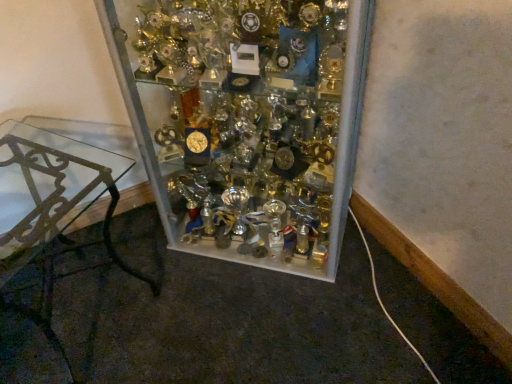
Question: Looking at their shapes, would you say clear glass trophy case at center is wider or thinner than clear glass table at left?

Choices:
 (A) thin
 (B) wide

Answer: (B)

Question: From the image's perspective, is clear glass trophy case at center above or below clear glass table at left?

Choices:
 (A) below
 (B) above

Answer: (B)

Question: Is clear glass trophy case at center inside or outside of clear glass table at left?

Choices:
 (A) inside
 (B) outside

Answer: (B)

Question: In the image, is clear glass table at left on the left side or the right side of clear glass trophy case at center?

Choices:
 (A) left
 (B) right

Answer: (A)

Question: Considering their positions, is clear glass table at left located in front of or behind clear glass trophy case at center?

Choices:
 (A) behind
 (B) front

Answer: (B)

Question: From their relative heights in the image, would you say clear glass table at left is taller or shorter than clear glass trophy case at center?

Choices:
 (A) tall
 (B) short

Answer: (B)

Question: Is clear glass table at left inside the boundaries of clear glass trophy case at center, or outside?

Choices:
 (A) outside
 (B) inside

Answer: (A)